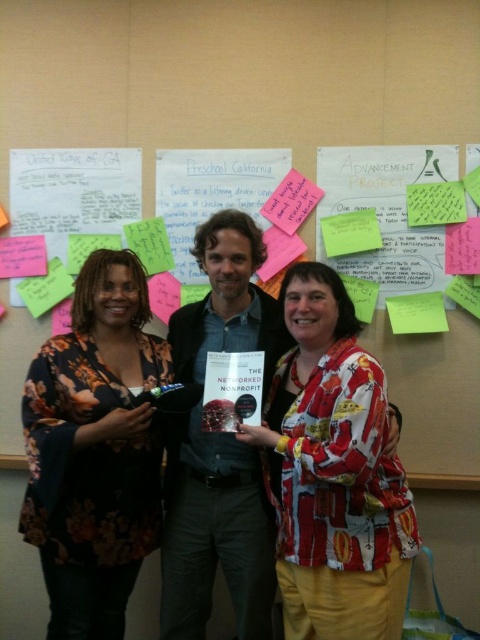
You are an observer in the conference room. You see the denim shirt at center and the white paper notes at upper center. Which object is positioned higher in the image?

The denim shirt at center is above white paper notes at upper center, so the denim shirt at center is positioned higher.

You are an observer in the conference room. You notice the floral print blouse at left and the white paper notes at upper center. Which object is taller?

The floral print blouse at left is taller than the white paper notes at upper center.

Looking at this image, based on the scene description, can you determine if the person wearing the floral print blouse at left is wider than the person in the denim shirt at center?

The floral print blouse at left might be wider than denim shirt at center according to the description.